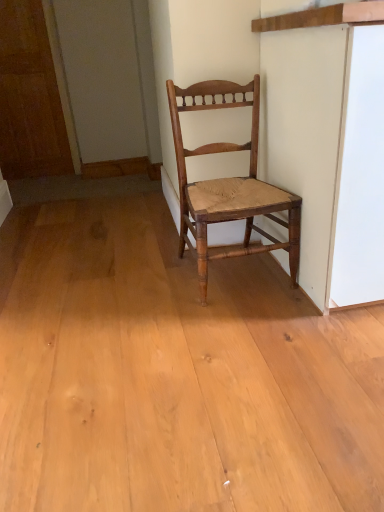
Question: Is wooden door at left shorter than natural wood chair at center?

Choices:
 (A) no
 (B) yes

Answer: (A)

Question: From a real-world perspective, is wooden door at left positioned under natural wood chair at center based on gravity?

Choices:
 (A) yes
 (B) no

Answer: (B)

Question: Is wooden door at left oriented towards natural wood chair at center?

Choices:
 (A) no
 (B) yes

Answer: (A)

Question: From the image's perspective, is wooden door at left below natural wood chair at center?

Choices:
 (A) yes
 (B) no

Answer: (B)

Question: From a real-world perspective, is wooden door at left physically above natural wood chair at center?

Choices:
 (A) no
 (B) yes

Answer: (B)

Question: Does wooden door at left have a greater width compared to natural wood chair at center?

Choices:
 (A) no
 (B) yes

Answer: (A)

Question: Does natural wood chair at center have a lesser width compared to wooden door at left?

Choices:
 (A) no
 (B) yes

Answer: (A)

Question: Does natural wood chair at center have a greater height compared to wooden door at left?

Choices:
 (A) yes
 (B) no

Answer: (B)

Question: From a real-world perspective, is natural wood chair at center on top of wooden door at left?

Choices:
 (A) no
 (B) yes

Answer: (A)

Question: Does natural wood chair at center turn towards wooden door at left?

Choices:
 (A) yes
 (B) no

Answer: (B)

Question: Considering the relative sizes of natural wood chair at center and wooden door at left in the image provided, is natural wood chair at center wider than wooden door at left?

Choices:
 (A) yes
 (B) no

Answer: (A)

Question: Is natural wood chair at center located outside wooden door at left?

Choices:
 (A) yes
 (B) no

Answer: (A)

Question: Looking at the image, does wooden door at left seem bigger or smaller compared to natural wood chair at center?

Choices:
 (A) big
 (B) small

Answer: (B)